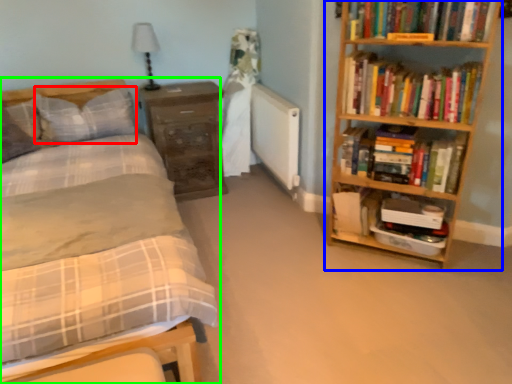
Question: Based on their relative distances, which object is nearer to pillow (highlighted by a red box)? Choose from bookcase (highlighted by a blue box) and bed (highlighted by a green box).

Choices:
 (A) bookcase
 (B) bed

Answer: (B)